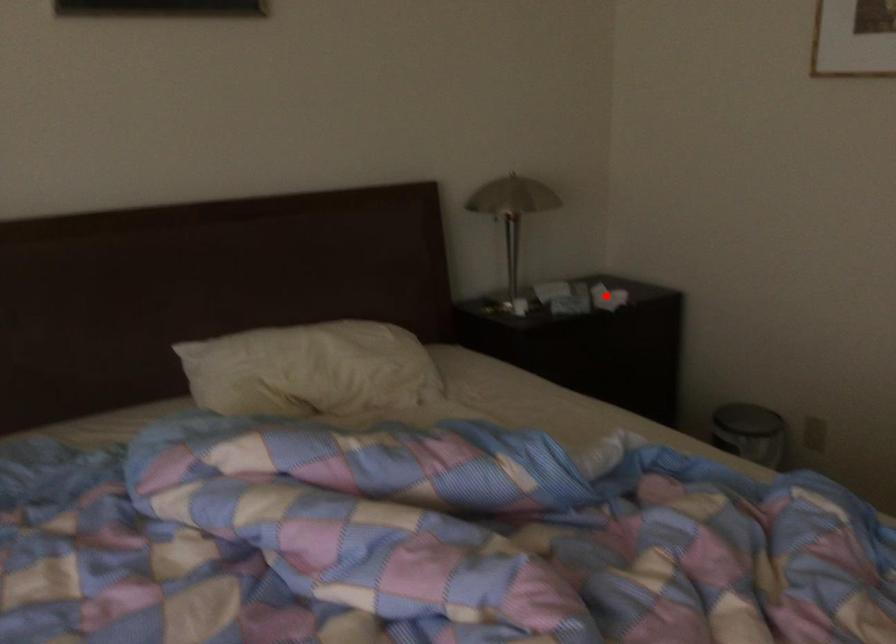
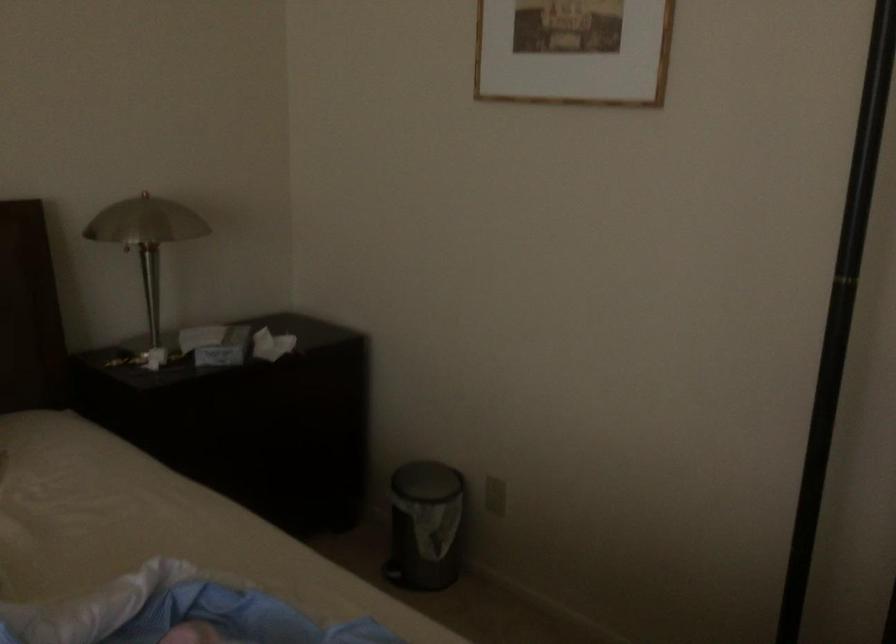
Question: A red point is marked in image1. In image2, is the corresponding 3D point closer to the camera or farther? Reply with the corresponding letter.

Choices:
 (A) The corresponding 3D point is closer.
 (B) The corresponding 3D point is farther.

Answer: (A)